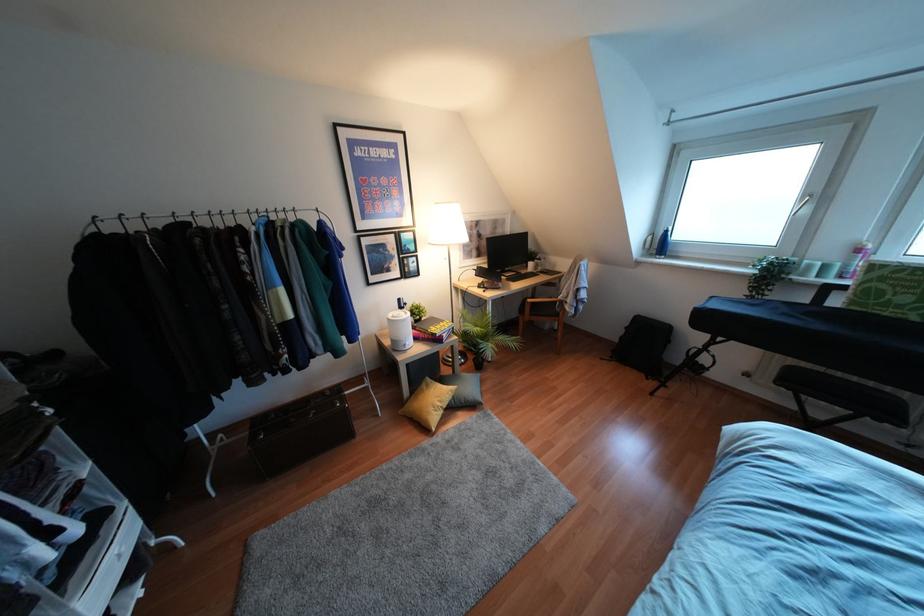
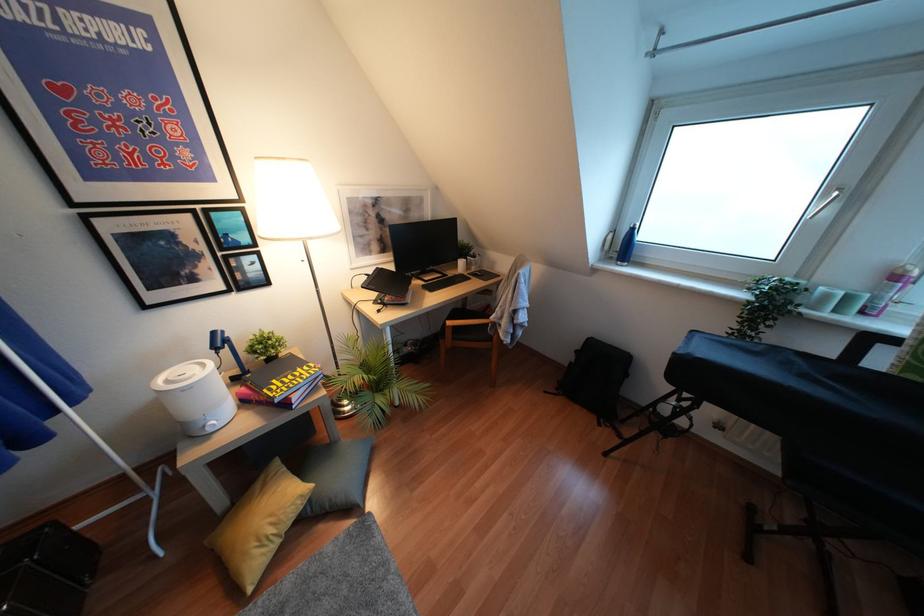
Where in the second image is the point corresponding to [824,267] from the first image?

(846, 298)